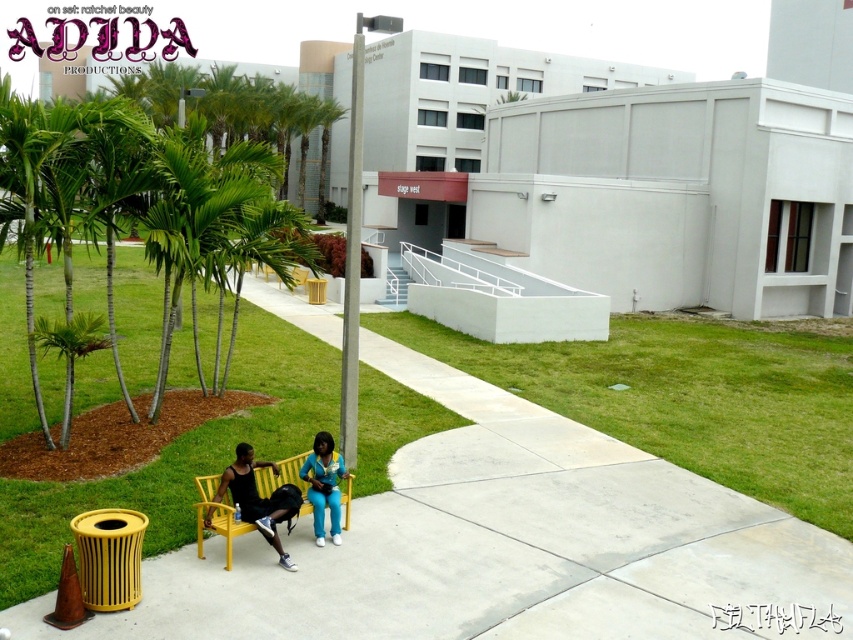
You are a maintenance worker who needs to water the green grass at lower left using a hose that can reach up to 15 meters. There is a yellow concrete bench at lower center in the way. Can you reach the grass from your current position near the bench without moving the bench?

The yellow concrete bench at lower center is 14.50 meters from the green grass at lower left. Since the hose can reach up to 15 meters, you can water the green grass at lower left from your current position near the bench without needing to move it.

You are standing at the entrance of Stage West and want to find the blue fabric jacket at center. According to the coordinates provided, in which direction should you look relative to your current position?

The blue fabric jacket at center is located at coordinates point (323, 484), which means it is positioned to the right and slightly forward from the entrance of Stage West.